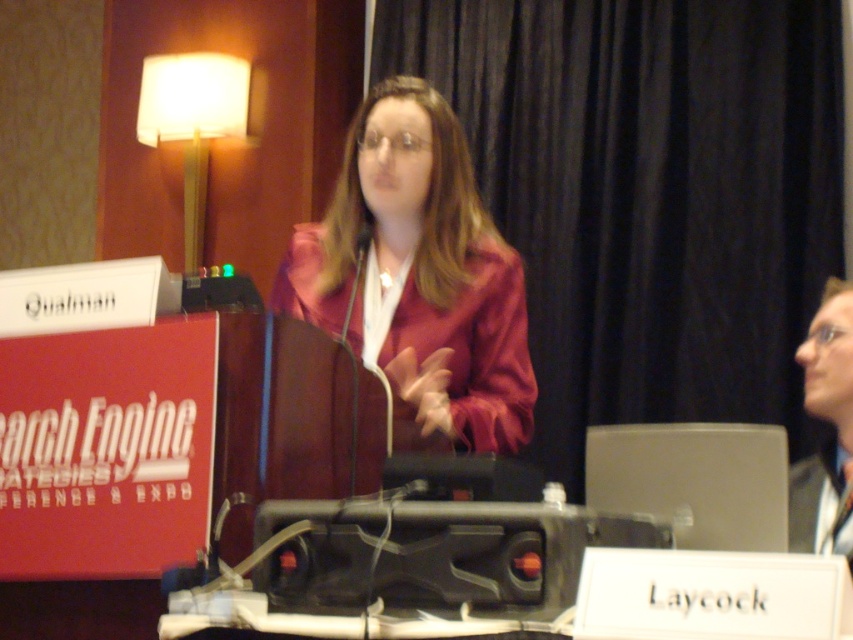
Based on the scene described, where is the satin red jacket at center located in relation to the white fabric lampshade at upper left?

The satin red jacket at center is to the right of the white fabric lampshade at upper left.

You are attending the Search Engine Strategies Conference and see the white fabric lampshade at upper left and the matte black laptop at upper right. Which object is taller?

The white fabric lampshade at upper left is taller than the matte black laptop at upper right.

From the picture: You are an event organizer and need to ensure that the satin red jacket at center does not block the white fabric lampshade at upper left during the presentation. Based on their sizes, is there a risk that the jacket could cover the lampshade?

The satin red jacket at center might be wider than white fabric lampshade at upper left, so there is a possibility that the jacket could cover the lampshade if not positioned carefully.